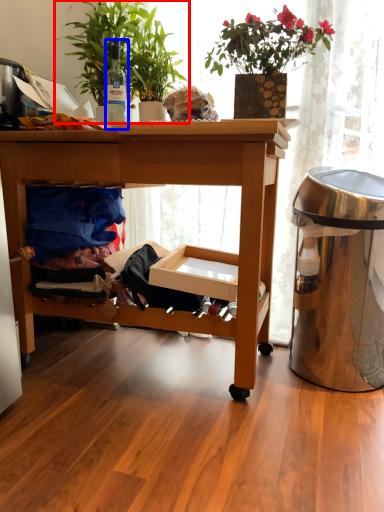
Question: Which object is further to the camera taking this photo, houseplant (highlighted by a red box) or bottle (highlighted by a blue box)?

Choices:
 (A) houseplant
 (B) bottle

Answer: (B)